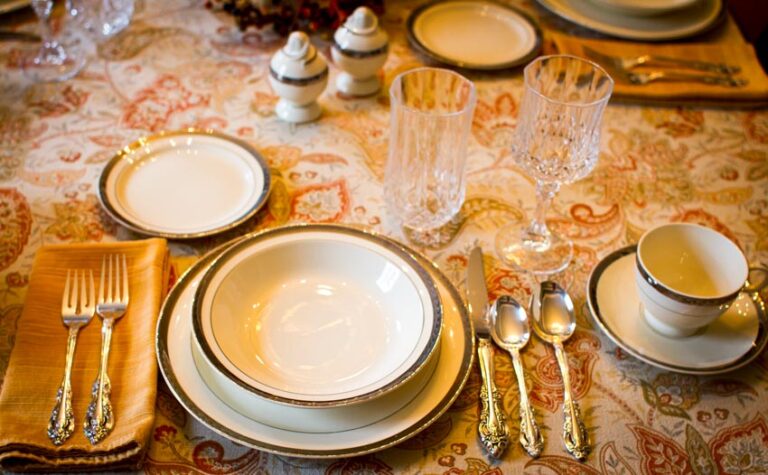
This screenshot has height=475, width=768. In order to click on plates in this screenshot , I will do `click(166, 192)`, `click(478, 34)`, `click(627, 29)`, `click(631, 345)`, `click(260, 426)`.